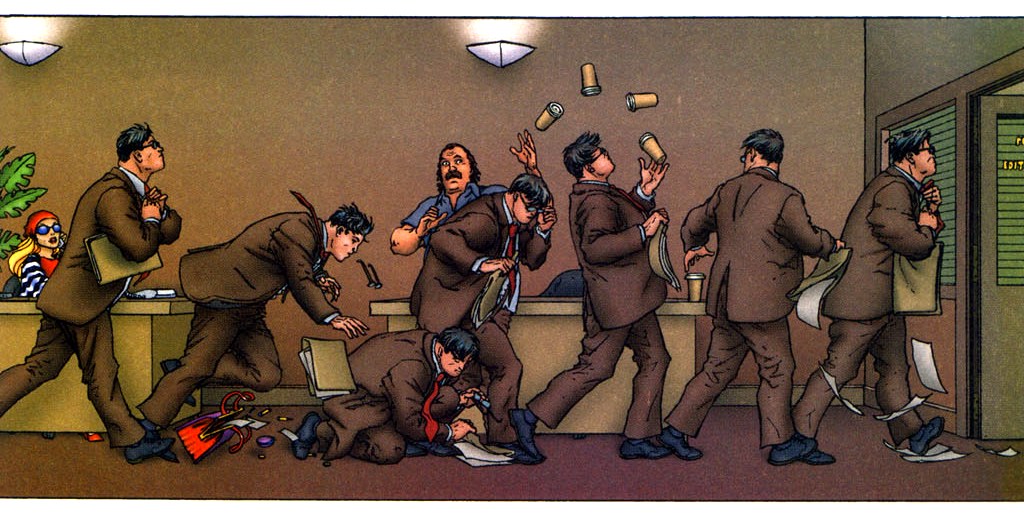
Find the location of a particular element. The image size is (1024, 513). desk is located at coordinates (547, 350), (14, 340).